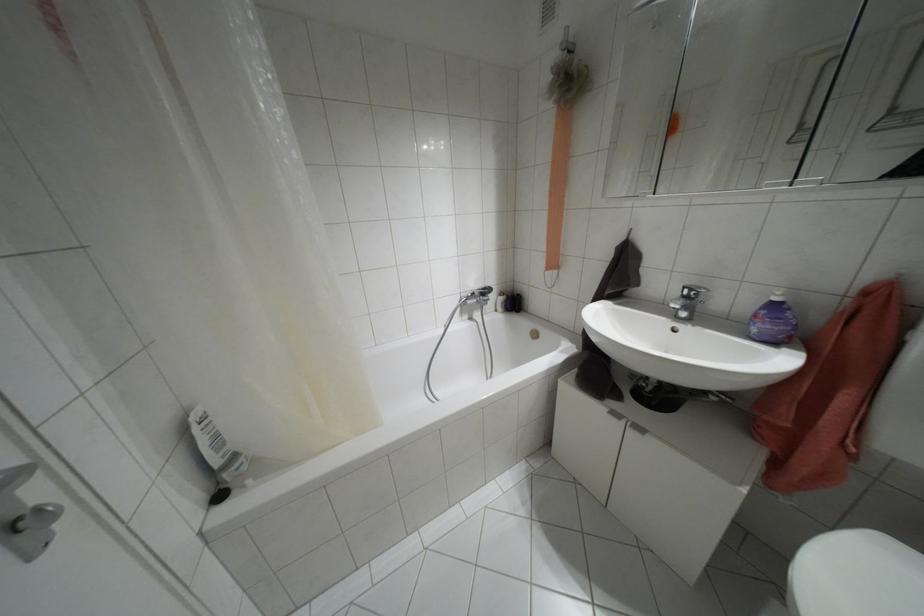
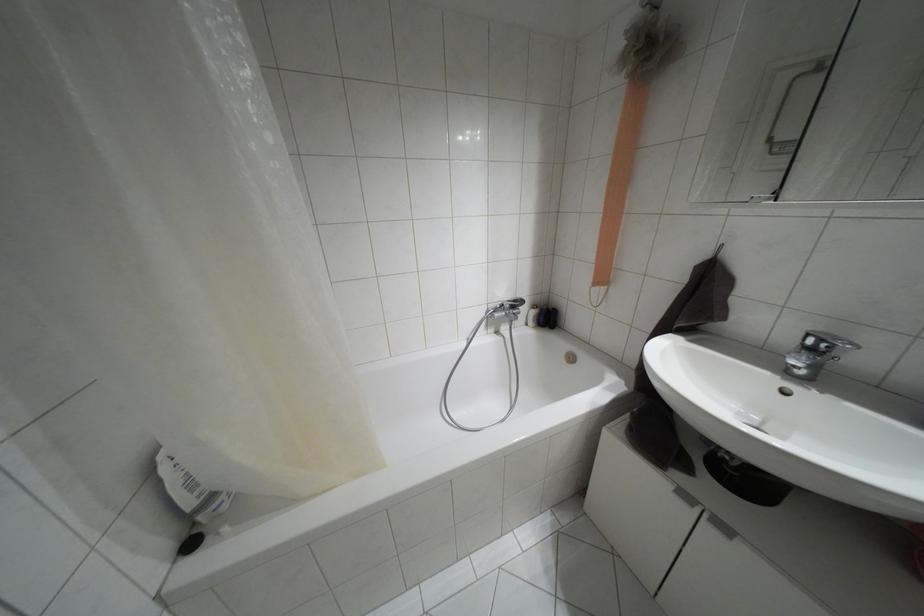
In the second image, find the point that corresponds to point (684, 286) in the first image.

(808, 334)